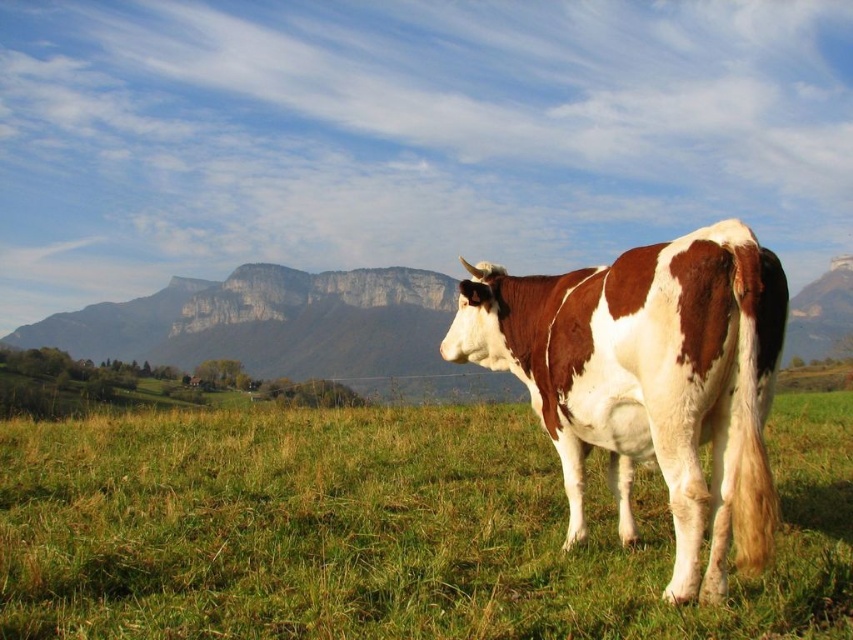
Which is in front, point (225, 547) or point (619, 515)?

Positioned in front is point (225, 547).

Is green grassy at center thinner than brown and white speckled cow at center?

In fact, green grassy at center might be wider than brown and white speckled cow at center.

Is point (67, 444) behind point (743, 419)?

Yes, point (67, 444) is behind point (743, 419).

The height and width of the screenshot is (640, 853). I want to click on green grassy at center, so click(383, 531).